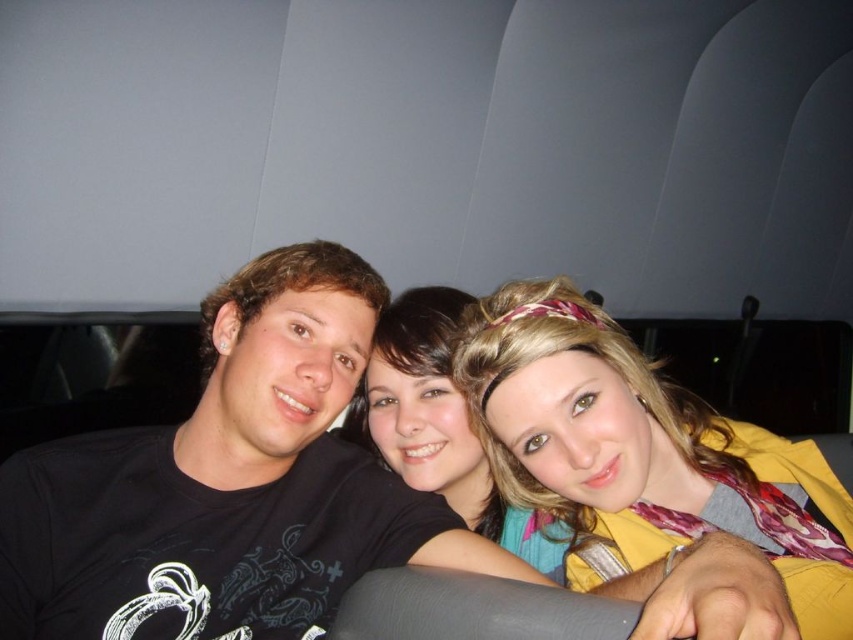
Is black cotton t-shirt at center behind yellow fabric headband at upper right?

Yes.

Who is positioned more to the right, black cotton t-shirt at center or yellow fabric headband at upper right?

yellow fabric headband at upper right

This screenshot has width=853, height=640. What are the coordinates of `black cotton t-shirt at center` in the screenshot? It's located at click(x=229, y=484).

Does black cotton t-shirt at center have a greater width compared to matte black shirt at center?

Indeed, black cotton t-shirt at center has a greater width compared to matte black shirt at center.

Who is more forward, [300,518] or [413,288]?

Positioned in front is point [300,518].

Is point (241, 621) closer to camera compared to point (445, 429)?

Yes, it is in front of point (445, 429).

Locate an element on the screen. The height and width of the screenshot is (640, 853). black cotton t-shirt at center is located at coordinates (229, 484).

Is yellow fabric headband at upper right to the left of matte black shirt at center from the viewer's perspective?

Incorrect, yellow fabric headband at upper right is not on the left side of matte black shirt at center.

Is yellow fabric headband at upper right smaller than matte black shirt at center?

Yes, yellow fabric headband at upper right is smaller than matte black shirt at center.

The image size is (853, 640). In order to click on yellow fabric headband at upper right in this screenshot , I will do `click(639, 451)`.

The width and height of the screenshot is (853, 640). Find the location of `yellow fabric headband at upper right`. yellow fabric headband at upper right is located at coordinates (639, 451).